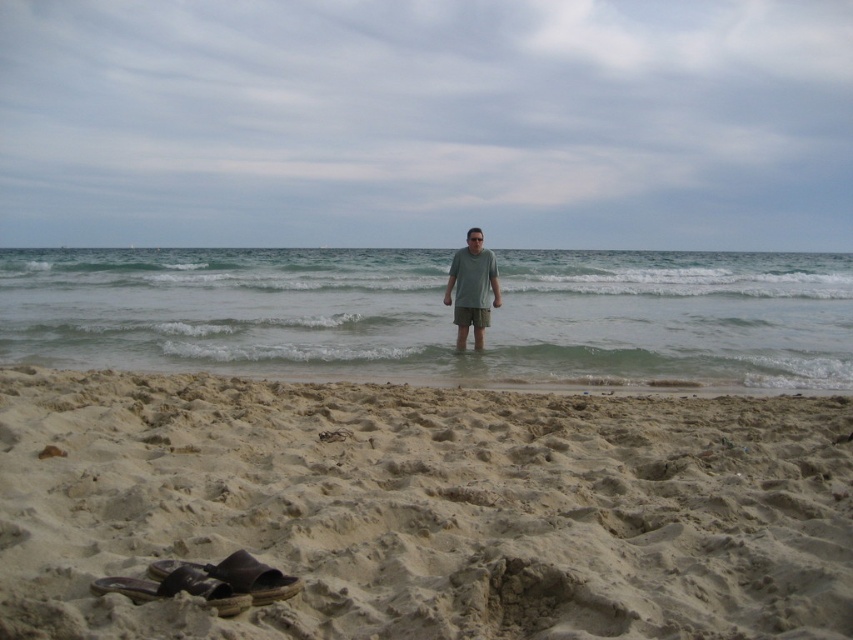
Is clear water at center below matte gray shorts at center?

No, clear water at center is not below matte gray shorts at center.

Can you confirm if clear water at center is positioned above matte gray shorts at center?

Correct, clear water at center is located above matte gray shorts at center.

Where is `clear water at center`? This screenshot has height=640, width=853. clear water at center is located at coordinates (434, 314).

The image size is (853, 640). In order to click on clear water at center in this screenshot , I will do `click(434, 314)`.

Is clear water at center below brown leather sandal at lower left?

No, clear water at center is not below brown leather sandal at lower left.

Can you confirm if clear water at center is shorter than brown leather sandal at lower left?

No, clear water at center is not shorter than brown leather sandal at lower left.

Is point (363, 291) positioned after point (223, 573)?

Yes, point (363, 291) is farther from viewer.

Locate an element on the screen. This screenshot has height=640, width=853. clear water at center is located at coordinates (434, 314).

Can you confirm if light brown sandy beach at lower center is positioned above brown leather sandal at lower left?

Correct, light brown sandy beach at lower center is located above brown leather sandal at lower left.

Does point (544, 406) come in front of point (218, 577)?

No, (544, 406) is further to viewer.

Does point (494, 417) lie behind point (160, 573)?

Yes, point (494, 417) is behind point (160, 573).

The width and height of the screenshot is (853, 640). What are the coordinates of `light brown sandy beach at lower center` in the screenshot? It's located at (424, 509).